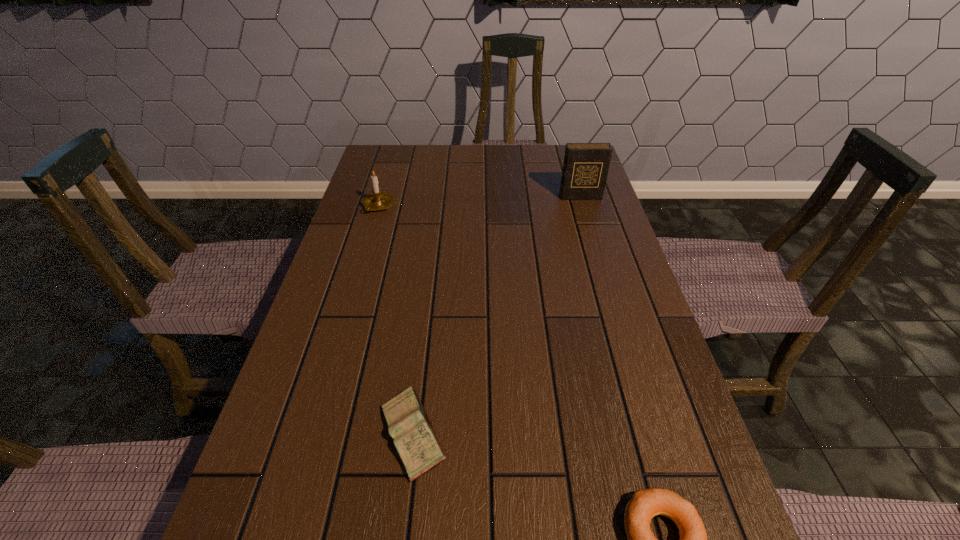
Locate an element on the screen. The image size is (960, 540). the right diary is located at coordinates (585, 169).

Find the location of a particular element. the tallest object is located at coordinates (585, 169).

This screenshot has height=540, width=960. I want to click on the leftmost object, so point(378,200).

You are a GUI agent. You are given a task and a screenshot of the screen. Output one action in this format:
    pyautogui.click(x=<x>, y=<y>)
    Task: Click on the second tallest object
    
    Given the screenshot: What is the action you would take?
    pyautogui.click(x=378, y=200)

What are the coordinates of `the nearer diary` in the screenshot? It's located at (414, 437).

Where is `the shorter diary`? the shorter diary is located at coordinates (414, 437).

Locate an element on the screen. This screenshot has height=540, width=960. vacant region located on the front cover of the right diary is located at coordinates (609, 292).

The height and width of the screenshot is (540, 960). I want to click on vacant space situated 0.310m on the right of the leftmost object, so click(498, 206).

Identify the location of vacant space located 0.110m on the back of the third object from right to left. This screenshot has height=540, width=960. (423, 348).

The width and height of the screenshot is (960, 540). I want to click on object positioned at the left edge, so click(378, 200).